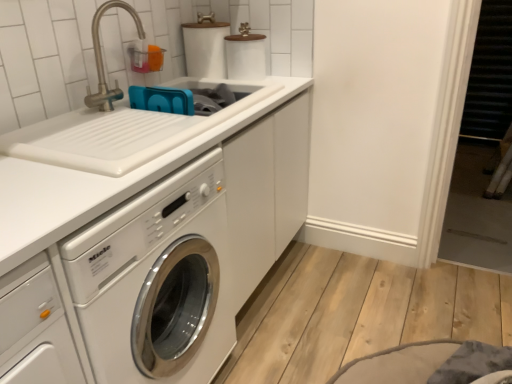
Question: Is white glossy sink at upper left positioned beyond the bounds of white matte toilet paper at upper center?

Choices:
 (A) yes
 (B) no

Answer: (A)

Question: Does white glossy sink at upper left appear on the left side of white matte toilet paper at upper center?

Choices:
 (A) no
 (B) yes

Answer: (B)

Question: From a real-world perspective, is white glossy sink at upper left beneath white matte toilet paper at upper center?

Choices:
 (A) no
 (B) yes

Answer: (B)

Question: Can you confirm if white glossy sink at upper left is wider than white matte toilet paper at upper center?

Choices:
 (A) yes
 (B) no

Answer: (A)

Question: Considering the relative sizes of white glossy sink at upper left and white matte toilet paper at upper center in the image provided, is white glossy sink at upper left thinner than white matte toilet paper at upper center?

Choices:
 (A) yes
 (B) no

Answer: (B)

Question: From the image's perspective, is brushed metal faucet at upper left located above or below white matte toilet paper at upper center?

Choices:
 (A) below
 (B) above

Answer: (A)

Question: Is brushed metal faucet at upper left inside or outside of white matte toilet paper at upper center?

Choices:
 (A) outside
 (B) inside

Answer: (A)

Question: Does point (111, 4) appear closer or farther from the camera than point (224, 29)?

Choices:
 (A) closer
 (B) farther

Answer: (A)

Question: Is brushed metal faucet at upper left wider or thinner than white matte toilet paper at upper center?

Choices:
 (A) thin
 (B) wide

Answer: (A)

Question: From the image's perspective, is white matte toilet paper at upper center located above or below white glossy sink at upper left?

Choices:
 (A) below
 (B) above

Answer: (B)

Question: Considering the positions of white matte toilet paper at upper center and white glossy sink at upper left in the image, is white matte toilet paper at upper center wider or thinner than white glossy sink at upper left?

Choices:
 (A) wide
 (B) thin

Answer: (B)

Question: From a real-world perspective, relative to white glossy sink at upper left, is white matte toilet paper at upper center vertically above or below?

Choices:
 (A) above
 (B) below

Answer: (A)

Question: Do you think white matte toilet paper at upper center is within white glossy sink at upper left, or outside of it?

Choices:
 (A) outside
 (B) inside

Answer: (A)

Question: Visually, is white glossy washing machine at center-left positioned to the left or to the right of white glossy sink at upper left?

Choices:
 (A) right
 (B) left

Answer: (B)

Question: In terms of height, does white glossy washing machine at center-left look taller or shorter compared to white glossy sink at upper left?

Choices:
 (A) short
 (B) tall

Answer: (B)